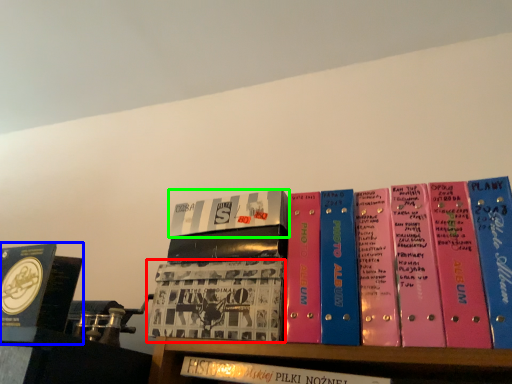
Question: Which is farther away from book (highlighted by a red box)? book (highlighted by a blue box) or book (highlighted by a green box)?

Choices:
 (A) book
 (B) book

Answer: (A)